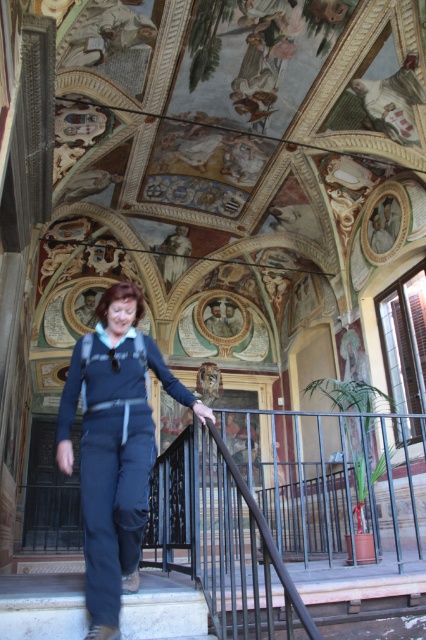
Question: Can you confirm if dark blue fabric pants at lower left is smaller than white marble stairs at lower left?

Choices:
 (A) yes
 (B) no

Answer: (B)

Question: Is dark blue fabric pants at lower left below white marble stairs at lower left?

Choices:
 (A) no
 (B) yes

Answer: (A)

Question: Does dark blue fabric pants at lower left have a smaller size compared to white marble stairs at lower left?

Choices:
 (A) no
 (B) yes

Answer: (A)